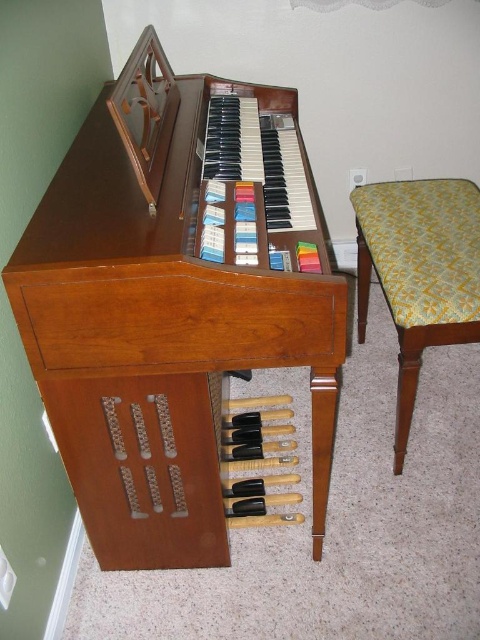
Question: Which point appears farthest from the camera in this image?

Choices:
 (A) (178, 420)
 (B) (95, 333)
 (C) (442, 330)

Answer: (C)

Question: Does wooden drawer at lower center appear over yellow-green fabric cushion at right?

Choices:
 (A) no
 (B) yes

Answer: (A)

Question: Which object is closer to the camera taking this photo?

Choices:
 (A) wooden piano at center
 (B) wooden drawer at lower center

Answer: (A)

Question: Observing the image, what is the correct spatial positioning of wooden piano at center in reference to yellow-green fabric cushion at right?

Choices:
 (A) left
 (B) right

Answer: (A)

Question: Observing the image, what is the correct spatial positioning of wooden piano at center in reference to wooden drawer at lower center?

Choices:
 (A) below
 (B) above

Answer: (B)

Question: Which of the following is the farthest from the observer?

Choices:
 (A) (48, 296)
 (B) (122, 435)

Answer: (B)